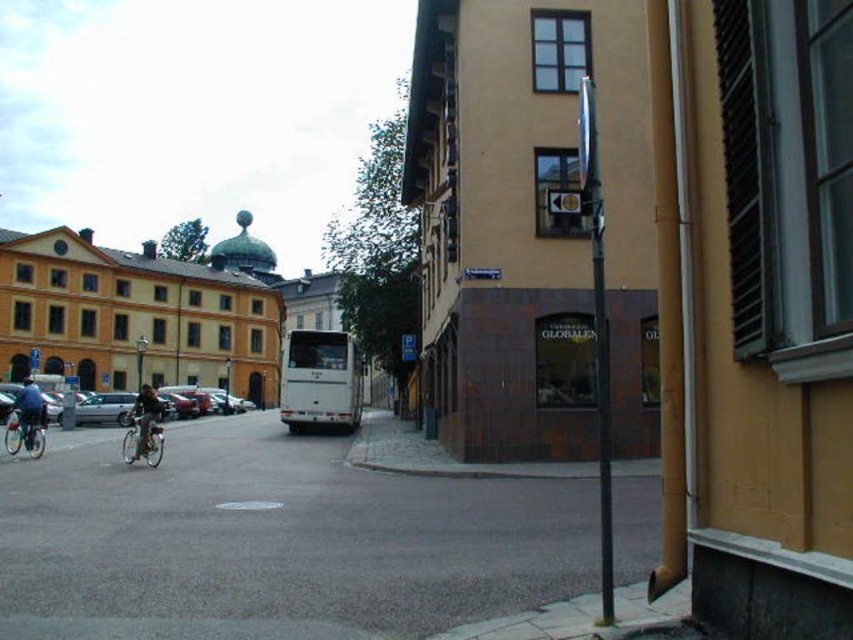
You are a delivery person who needs to park your 2.2 meter long delivery cart between the silver metallic bicycle at left and the silver metallic bicycle at lower left. Is there enough space for your cart?

The silver metallic bicycle at left and the silver metallic bicycle at lower left are 3.55 meters apart, so yes, the delivery cart can be parked between them since the space is wider than the cart.

You are a delivery person who needs to park your silver metallic bicycle at left next to the blue fabric jacket on the left. Given that the space available is only 1.2 meters wide, will the bicycle fit comfortably?

The silver metallic bicycle at left has a width less than the blue fabric jacket on the left, but the jacket width isn

You are a delivery person who needs to place a large package on the sidewalk between the silver metallic bicycle at left and the blue fabric jacket on the left. Which object should you move to make space?

The silver metallic bicycle at left has a smaller size compared to the blue fabric jacket on the left, so you should move the blue fabric jacket on the left to create more space for the large package.